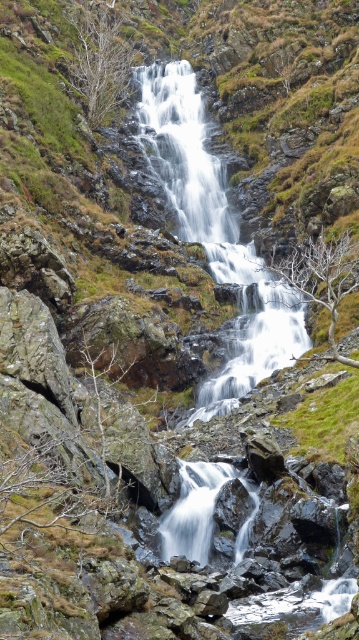
Can you confirm if white frothy water at center is smaller than white smooth water at center?

Incorrect, white frothy water at center is not smaller in size than white smooth water at center.

The width and height of the screenshot is (359, 640). What do you see at coordinates (213, 234) in the screenshot? I see `white frothy water at center` at bounding box center [213, 234].

Where is `white frothy water at center`? This screenshot has width=359, height=640. white frothy water at center is located at coordinates (213, 234).